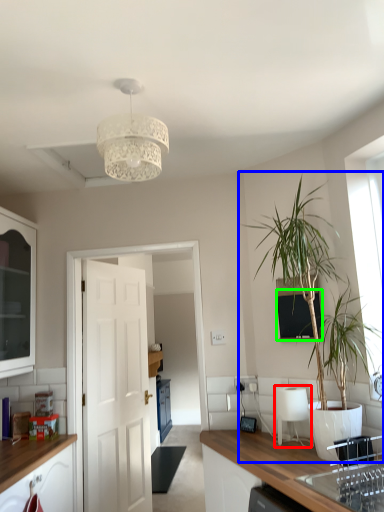
Question: Which object is the closest to the appliance (highlighted by a red box)? Choose among these: houseplant (highlighted by a blue box) or window screen (highlighted by a green box).

Choices:
 (A) houseplant
 (B) window screen

Answer: (B)